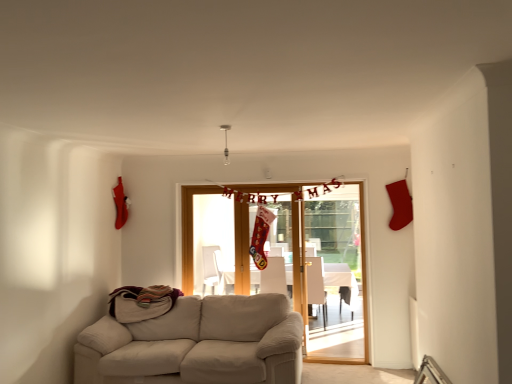
Question: Is white glossy table at center situated inside white fabric armchair at center, acting as the 1th armchair starting from the left, or outside?

Choices:
 (A) outside
 (B) inside

Answer: (A)

Question: Considering the positions of white glossy table at center and white fabric armchair at center, acting as the 1th armchair starting from the left, in the image, is white glossy table at center bigger or smaller than white fabric armchair at center, acting as the 1th armchair starting from the left,?

Choices:
 (A) small
 (B) big

Answer: (B)

Question: Estimate the real-world distances between objects in this image. Which object is closer to the matte white armchair at center, positioned as the 1th armchair in right-to-left order?

Choices:
 (A) wooden door at center
 (B) white glossy table at center
 (C) white fabric armchair at center, acting as the 1th armchair starting from the left
 (D) beige fabric couch at lower left

Answer: (C)

Question: Which is farther from the white fabric armchair at center, acting as the 1th armchair starting from the left?

Choices:
 (A) beige fabric couch at lower left
 (B) wooden door at center
 (C) white glossy table at center
 (D) matte white armchair at center, which appears as the second armchair when viewed from the left

Answer: (A)